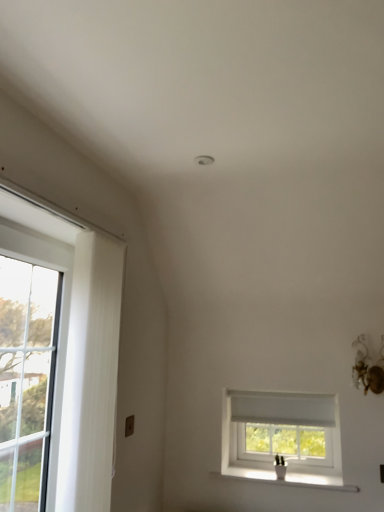
In order to face clear glass door at left, should I rotate leftwards or rightwards?

To face it directly, rotate left by 21.061 degrees.

What do you see at coordinates (26, 380) in the screenshot? Image resolution: width=384 pixels, height=512 pixels. I see `clear glass door at left` at bounding box center [26, 380].

At what (x,y) coordinates should I click in order to perform the action: click on white textured curtain at left. Please return your answer as a coordinate pair (x, y). Looking at the image, I should click on coord(91,376).

Where is `white plastic window at center`? This screenshot has width=384, height=512. white plastic window at center is located at coordinates (282, 437).

Is white ceramic vase at lower right further to camera compared to clear glass door at left?

Yes, the depth of white ceramic vase at lower right is greater than that of clear glass door at left.

Considering the relative sizes of white ceramic vase at lower right and clear glass door at left in the image provided, is white ceramic vase at lower right shorter than clear glass door at left?

Yes, white ceramic vase at lower right is shorter than clear glass door at left.

From a real-world perspective, does white ceramic vase at lower right stand above clear glass door at left?

Actually, white ceramic vase at lower right is physically below clear glass door at left in the real world.

Is white ceramic vase at lower right wider or thinner than clear glass door at left?

In the image, white ceramic vase at lower right appears to be wider than clear glass door at left.

Is clear glass door at left facing towards white textured curtain at left?

Yes, clear glass door at left is facing white textured curtain at left.

Considering their positions, is clear glass door at left located in front of or behind white textured curtain at left?

In the image, clear glass door at left appears in front of white textured curtain at left.

Considering the sizes of objects clear glass door at left and white textured curtain at left in the image provided, who is wider, clear glass door at left or white textured curtain at left?

clear glass door at left is wider.

Is white ceramic vase at lower right wider or thinner than white plastic window at center?

white ceramic vase at lower right is thinner than white plastic window at center.

Where is `window sill on the left of white plastic window at center`? The height and width of the screenshot is (512, 384). window sill on the left of white plastic window at center is located at coordinates (289, 479).

Is white ceramic vase at lower right positioned far away from white plastic window at center?

No, white ceramic vase at lower right is not far away from white plastic window at center.

From a real-world perspective, which object stands above the other?

white plastic window at center.

From the image's perspective, between white textured curtain at left and white plastic window at center, who is located below?

white plastic window at center, from the image's perspective.

From a real-world perspective, is white textured curtain at left above or below white plastic window at center?

From a real-world perspective, white textured curtain at left is physically above white plastic window at center.

From the image's perspective, between clear glass door at left and white ceramic vase at lower right, who is located below?

From the image's view, white ceramic vase at lower right is below.

Looking at their sizes, would you say clear glass door at left is wider or thinner than white ceramic vase at lower right?

clear glass door at left is thinner than white ceramic vase at lower right.

Based on the photo, from a real-world perspective, is clear glass door at left positioned over white ceramic vase at lower right based on gravity?

Correct, in the physical world, clear glass door at left is higher than white ceramic vase at lower right.

Where is `curtain that appears behind the clear glass door at left`? curtain that appears behind the clear glass door at left is located at coordinates (91, 376).

Is white textured curtain at left aimed at clear glass door at left?

No.

From the image's perspective, is white textured curtain at left located above or below clear glass door at left?

Based on their image positions, white textured curtain at left is located beneath clear glass door at left.

From a real-world perspective, which is physically below, white textured curtain at left or clear glass door at left?

In real-world perspective, clear glass door at left is lower.

Is clear glass door at left thinner than white plastic window at center?

Yes, clear glass door at left is thinner than white plastic window at center.

In order to click on window directly beneath the clear glass door at left (from a real-world perspective) in this screenshot , I will do `click(282, 437)`.

Does point (12, 478) appear closer or farther from the camera than point (294, 413)?

Point (12, 478) appears to be closer to the viewer than point (294, 413).

Is clear glass door at left not near white plastic window at center?

That's right, there is a large distance between clear glass door at left and white plastic window at center.

You are a GUI agent. You are given a task and a screenshot of the screen. Output one action in this format:
    pyautogui.click(x=<x>, y=<y>)
    Task: Click on the glass door above the white ceramic vase at lower right (from a real-world perspective)
    Image resolution: width=384 pixels, height=512 pixels.
    Given the screenshot: What is the action you would take?
    [26, 380]

This screenshot has width=384, height=512. What are the coordinates of `curtain located below the clear glass door at left (from the image's perspective)` in the screenshot? It's located at (91, 376).

Looking at the image, which one is located further to clear glass door at left, white ceramic vase at lower right or white textured curtain at left?

white ceramic vase at lower right.

When comparing their distances from white plastic window at center, does white ceramic vase at lower right or clear glass door at left seem closer?

Among the two, white ceramic vase at lower right is located nearer to white plastic window at center.

When comparing their distances from white ceramic vase at lower right, does clear glass door at left or white plastic window at center seem closer?

white plastic window at center lies closer to white ceramic vase at lower right than the other object.

From the image, which object appears to be nearer to white plastic window at center, white textured curtain at left or white ceramic vase at lower right?

Among the two, white ceramic vase at lower right is located nearer to white plastic window at center.

Which object lies nearer to the anchor point white plastic window at center, white ceramic vase at lower right or white textured curtain at left?

Among the two, white ceramic vase at lower right is located nearer to white plastic window at center.

Which object lies further to the anchor point white plastic window at center, clear glass door at left or white ceramic vase at lower right?

clear glass door at left lies further to white plastic window at center than the other object.

When comparing their distances from white plastic window at center, does clear glass door at left or white textured curtain at left seem closer?

white textured curtain at left is positioned closer to the anchor white plastic window at center.

Considering their positions, is white ceramic vase at lower right positioned further to white textured curtain at left than clear glass door at left?

white ceramic vase at lower right lies further to white textured curtain at left than the other object.

Where is `curtain between clear glass door at left and white plastic window at center in the horizontal direction`? This screenshot has height=512, width=384. curtain between clear glass door at left and white plastic window at center in the horizontal direction is located at coordinates (91, 376).

Identify the location of window sill between clear glass door at left and white plastic window at center in the horizontal direction. (289, 479).

Locate an element on the screen. This screenshot has height=512, width=384. window sill situated between white textured curtain at left and white plastic window at center from left to right is located at coordinates click(289, 479).

This screenshot has height=512, width=384. In order to click on curtain between clear glass door at left and white ceramic vase at lower right in this screenshot , I will do `click(91, 376)`.